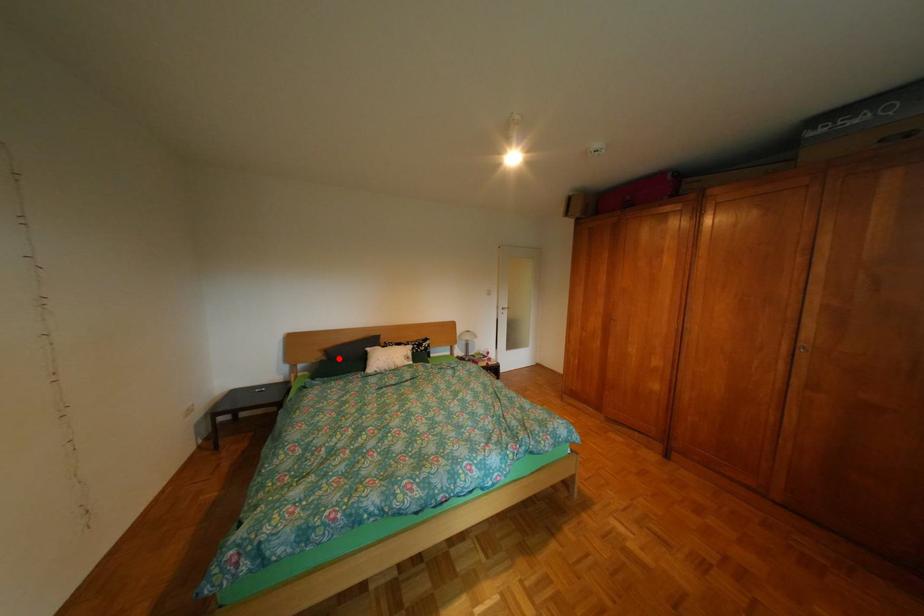
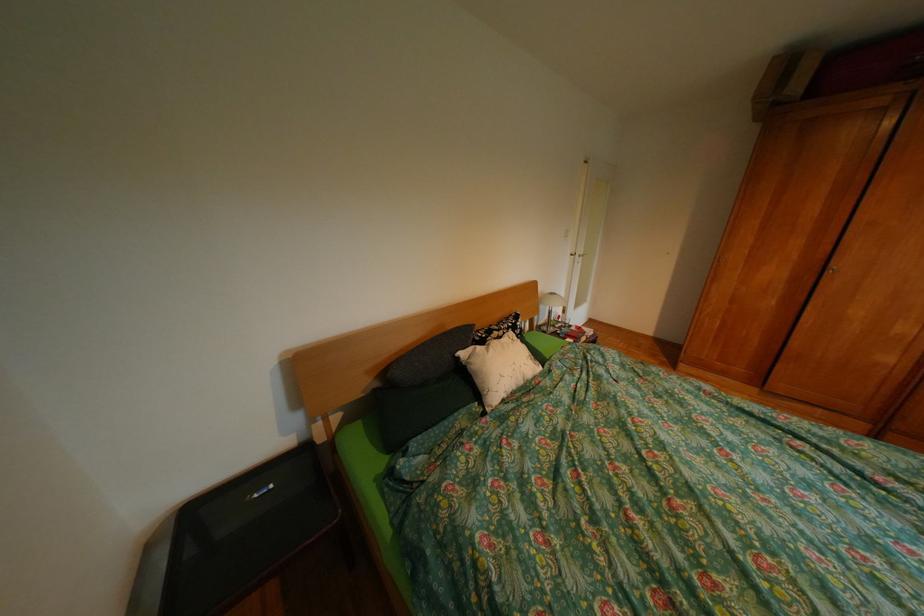
Where in the second image is the point corresponding to the highlighted location from the first image?

(392, 385)